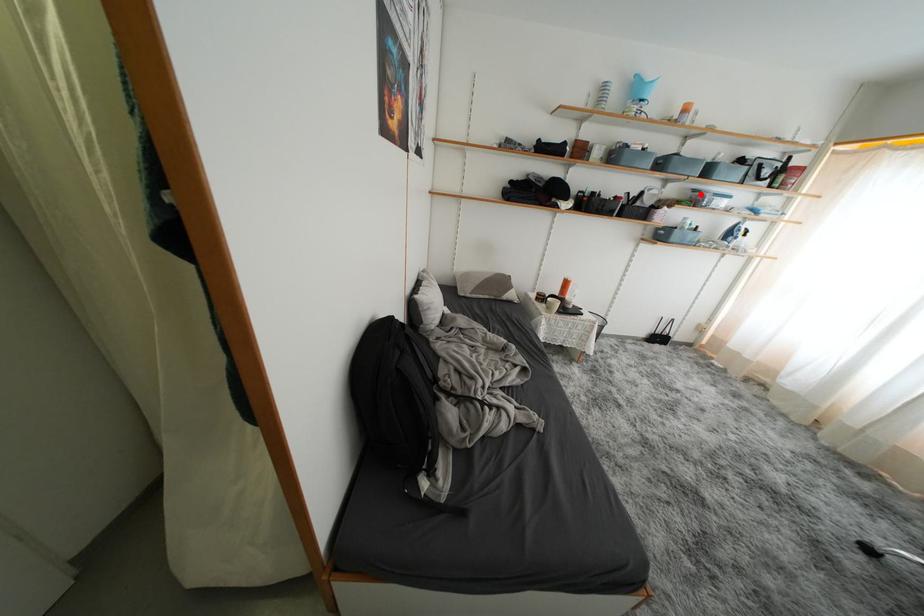
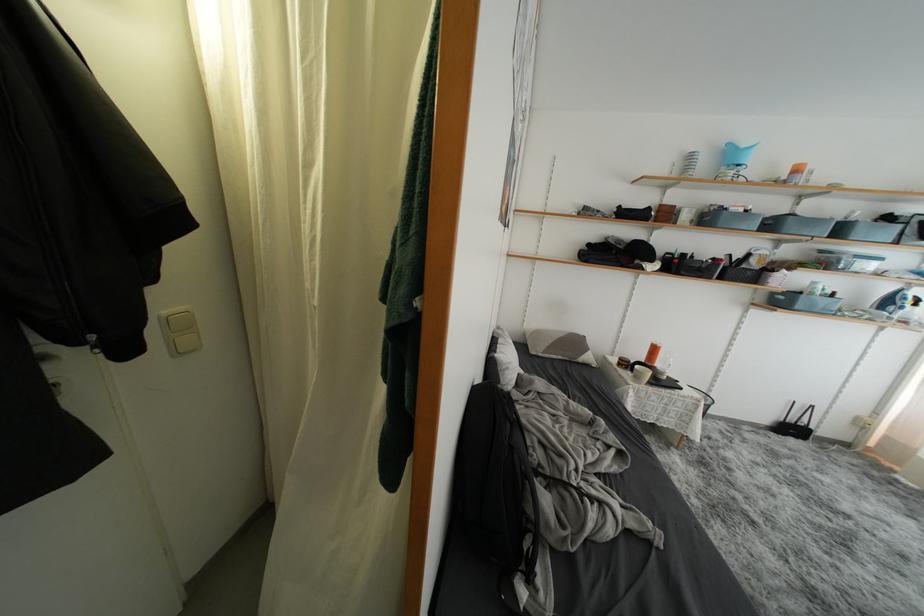
The point at the highlighted location is marked in the first image. Where is the corresponding point in the second image?

(829, 256)